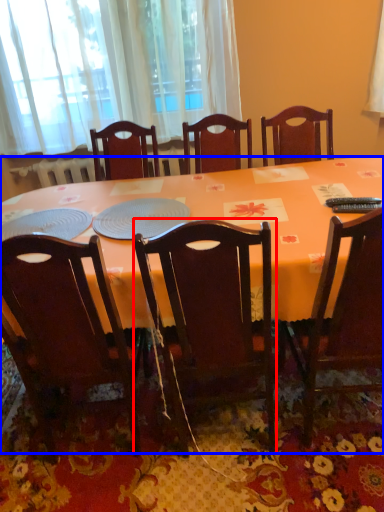
Question: Which of the following is the farthest to the observer, chair (highlighted by a red box) or desk (highlighted by a blue box)?

Choices:
 (A) chair
 (B) desk

Answer: (B)